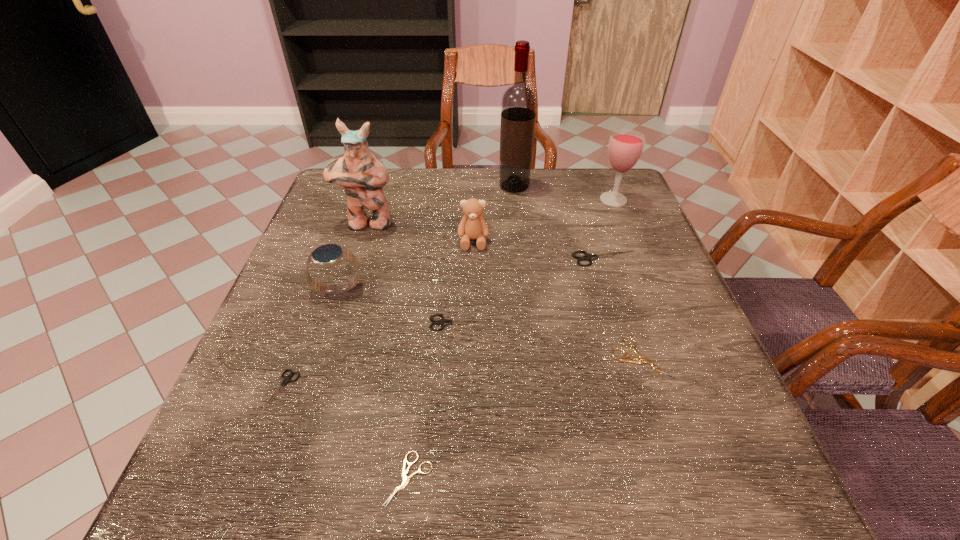
Where is `the fourth object from right to left`? The width and height of the screenshot is (960, 540). the fourth object from right to left is located at coordinates (519, 102).

Locate an element on the screen. The image size is (960, 540). wine bottle is located at coordinates (519, 102).

Image resolution: width=960 pixels, height=540 pixels. I want to click on pink figurine, so click(362, 175).

The width and height of the screenshot is (960, 540). Find the location of `the second tallest object`. the second tallest object is located at coordinates (362, 175).

Image resolution: width=960 pixels, height=540 pixels. I want to click on wineglass, so click(625, 147).

Find the location of a particular element. teddy bear is located at coordinates (473, 226).

Image resolution: width=960 pixels, height=540 pixels. I want to click on the fifth nearest object, so [x=328, y=255].

Locate an element on the screen. The height and width of the screenshot is (540, 960). watch is located at coordinates (328, 255).

Find the location of a particular element. The height and width of the screenshot is (540, 960). the tallest shears is located at coordinates (588, 257).

Locate an element on the screen. This screenshot has height=540, width=960. the farthest shears is located at coordinates (588, 257).